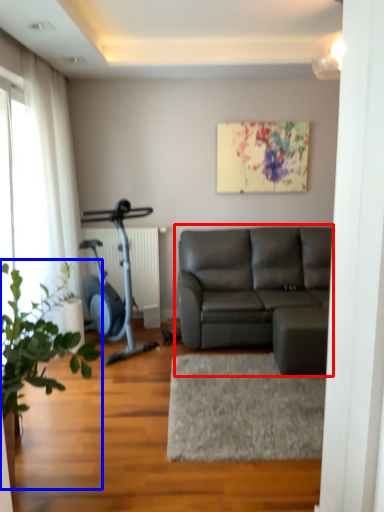
Question: Among these objects, which one is farthest to the camera, studio couch (highlighted by a red box) or houseplant (highlighted by a blue box)?

Choices:
 (A) studio couch
 (B) houseplant

Answer: (A)